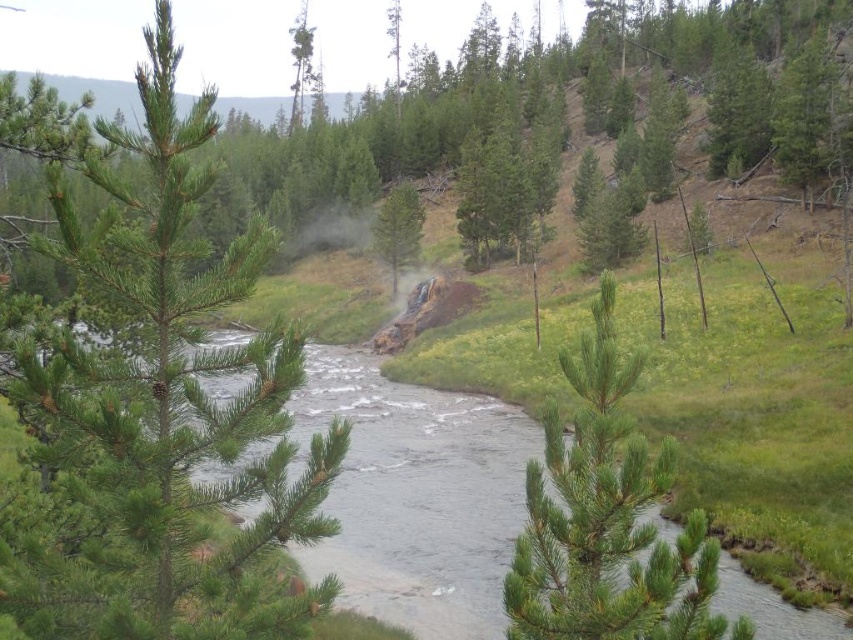
You are planning to build a small wooden bridge over the clear water at center and near the green matte tree at upper center. Based on their sizes, which object would require more materials to construct the bridge? Please explain your reasoning.

The green matte tree at upper center requires more materials because it is larger than the clear water at center, so the bridge near it would need to be bigger to accommodate its size.

You are standing at the center of the river and want to locate the green pine tree at upper right. According to the coordinates provided, in which direction should you look to find it?

The green pine tree at upper right is located at coordinates point (807, 116), which is in the upper right direction from your current position at the center of the river.